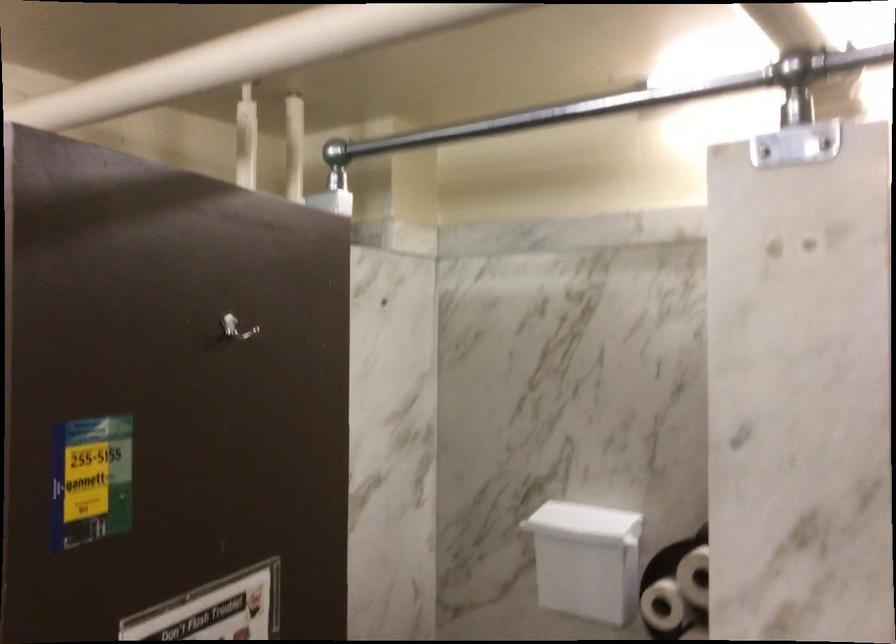
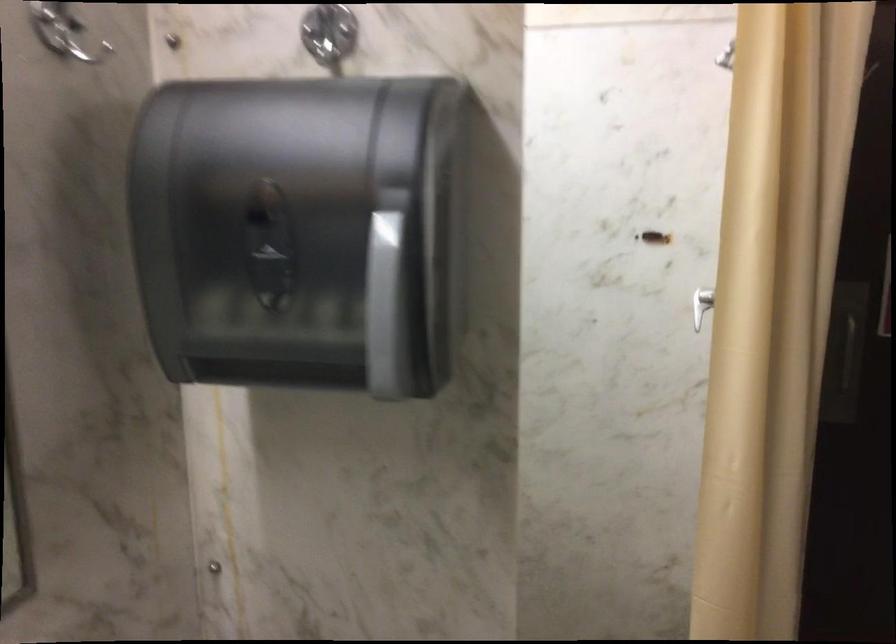
Question: Based on the continuous images, in which direction is the camera rotating? Reply with the corresponding letter.

Choices:
 (A) Left
 (B) Right
 (C) Up
 (D) Down

Answer: (A)